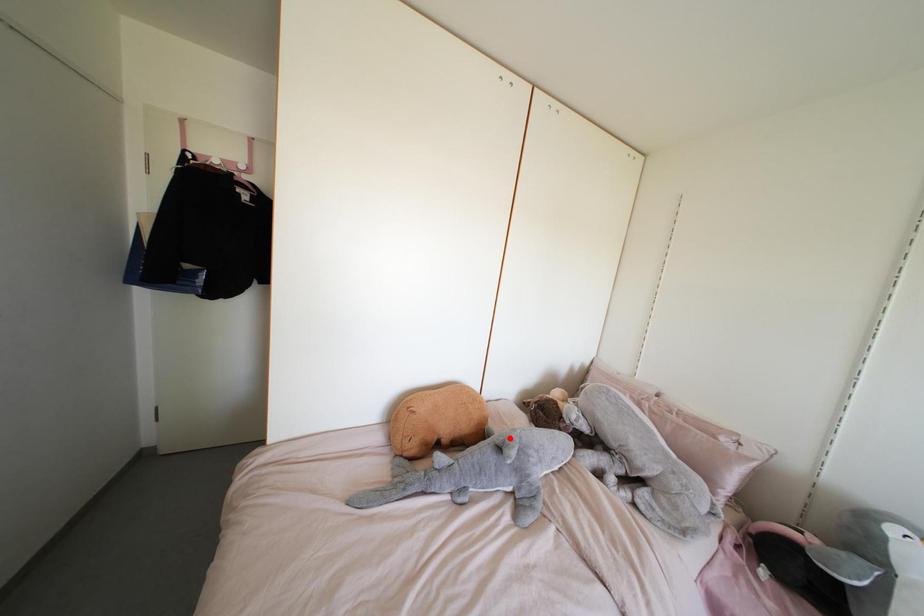
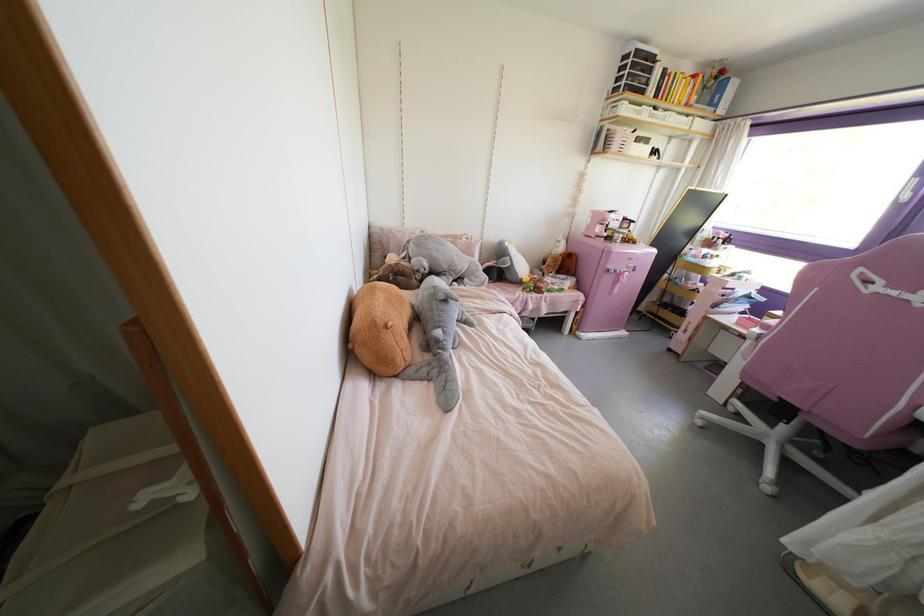
Question: I am providing you with two images of the same scene from different viewpoints. In image1, a red point is highlighted. Considering the same 3D point in image2, which of the following is correct?

Choices:
 (A) It is closer
 (B) It is farther

Answer: (B)